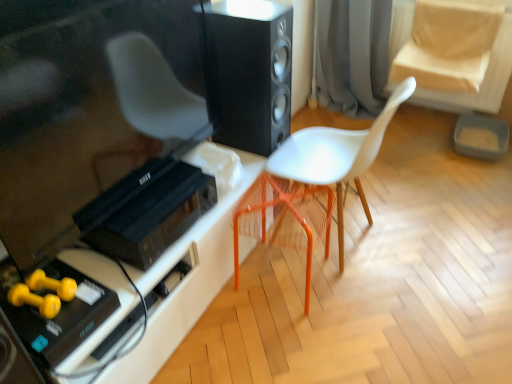
Locate an element on the screen. vacant area located to the right-hand side of white matte chair at center is located at coordinates (420, 236).